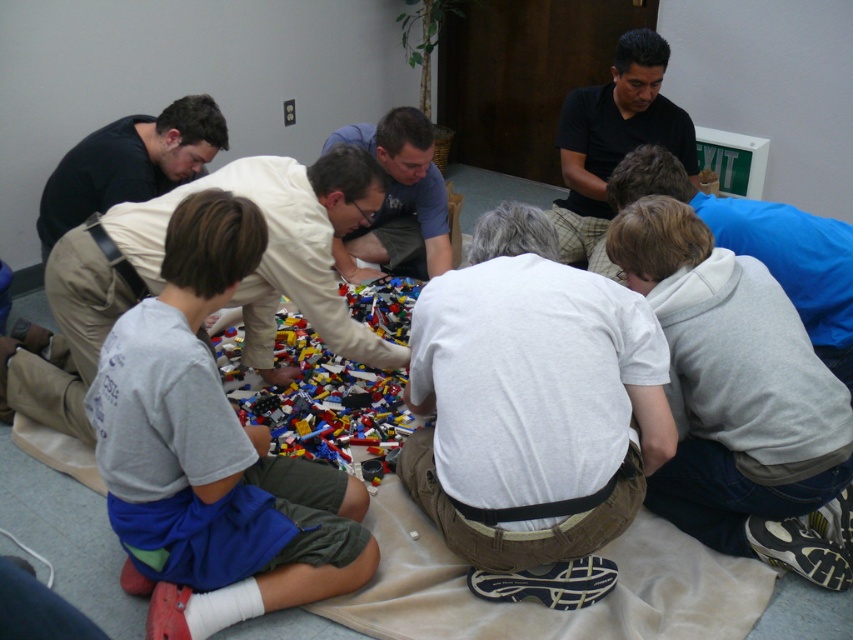
Question: Which object is the closest to the black matte shirt at upper center?

Choices:
 (A) black matte shirt at upper left
 (B) white matte shirt at center

Answer: (B)

Question: Can you confirm if white matte shirt at center is thinner than black matte shirt at upper center?

Choices:
 (A) yes
 (B) no

Answer: (B)

Question: Is white cotton shirt at center to the right of translucent plastic lego bricks at center from the viewer's perspective?

Choices:
 (A) yes
 (B) no

Answer: (A)

Question: Estimate the real-world distances between objects in this image. Which object is closer to the translucent plastic lego bricks at center?

Choices:
 (A) white cotton shirt at center
 (B) gray cotton shirt at center

Answer: (A)

Question: Based on their relative distances, which object is nearer to the gray hoodie at lower right?

Choices:
 (A) black matte shirt at upper left
 (B) white cotton shirt at center
 (C) white matte shirt at center

Answer: (B)

Question: Is translucent plastic lego bricks at center behind black matte shirt at upper center?

Choices:
 (A) no
 (B) yes

Answer: (A)